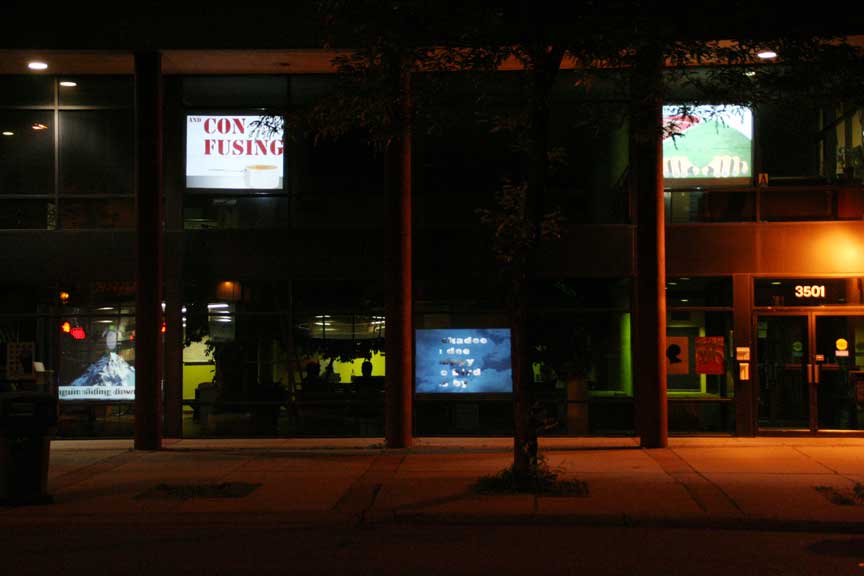
You are a GUI agent. You are given a task and a screenshot of the screen. Output one action in this format:
    pyautogui.click(x=<x>, y=<y>)
    Task: Click on the paper signs
    
    Given the screenshot: What is the action you would take?
    pyautogui.click(x=707, y=358), pyautogui.click(x=676, y=352)